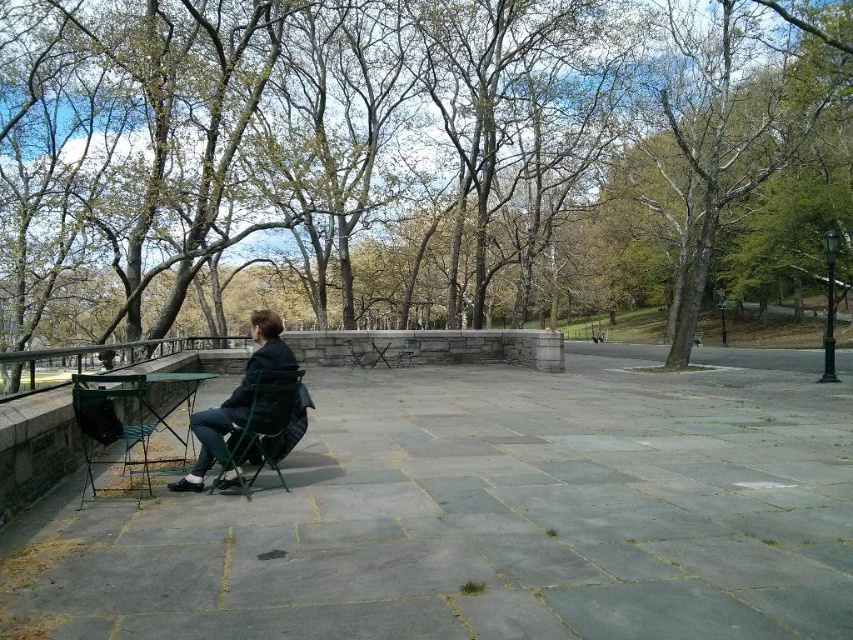
You are planning to place a new bench in the park scene so that it is between the metallic green chair at lower left and the green fabric chair at center. Based on their current positions, which chair should the bench be placed closer to?

The bench should be placed closer to the metallic green chair at lower left since it is positioned on the left side of the green fabric chair at center.

From the picture: What are the coordinates of the brown leafy tree at center?

The brown leafy tree at center is located at coordinates point (x=416, y=157).